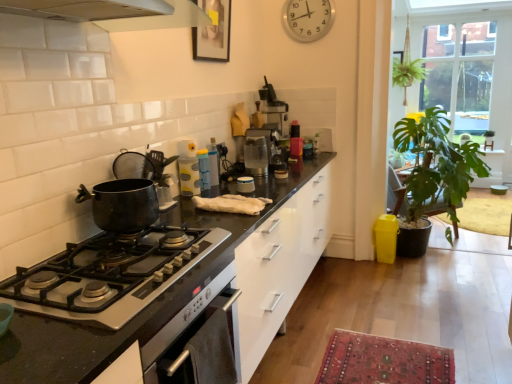
Find the location of a particular element. The width and height of the screenshot is (512, 384). translucent plastic container at center, the 2th appliance when ordered from back to front is located at coordinates (204, 171).

Describe the element at coordinates (110, 275) in the screenshot. The height and width of the screenshot is (384, 512). I see `black matte gas stove at lower left` at that location.

Where is `translucent plastic spray bottle at center, arranged as the 3th appliance when viewed from the top`? translucent plastic spray bottle at center, arranged as the 3th appliance when viewed from the top is located at coordinates (188, 168).

The width and height of the screenshot is (512, 384). In order to click on clear glass window at upper right in this screenshot , I will do `click(459, 74)`.

In order to click on wooden picture frame at upper center in this screenshot , I will do `click(213, 32)`.

Is clear glass window at upper right wider or thinner than metallic coffee machine at upper center, the first appliance positioned from the back?

Clearly, clear glass window at upper right has more width compared to metallic coffee machine at upper center, the first appliance positioned from the back.

Does clear glass window at upper right appear on the left side of metallic coffee machine at upper center, placed as the 1th appliance when sorted from right to left?

No, clear glass window at upper right is not to the left of metallic coffee machine at upper center, placed as the 1th appliance when sorted from right to left.

From a real-world perspective, is clear glass window at upper right above or below metallic coffee machine at upper center, arranged as the 1th appliance when viewed from the top?

In terms of real-world spatial position, clear glass window at upper right is above metallic coffee machine at upper center, arranged as the 1th appliance when viewed from the top.

Is clear glass window at upper right surrounding metallic coffee machine at upper center, placed as the 4th appliance when sorted from left to right?

No.

From a real-world perspective, who is located higher, white plastic container at center, the second appliance when ordered from right to left, or metallic coffee machine at upper center, placed as the 4th appliance when sorted from left to right?

metallic coffee machine at upper center, placed as the 4th appliance when sorted from left to right, is physically above.

Between point (241, 177) and point (270, 102), which one is positioned behind?

Point (270, 102)

Is white plastic container at center, which ranks as the 1th appliance in bottom-to-top order, far away from metallic coffee machine at upper center, the first appliance positioned from the back?

Yes, white plastic container at center, which ranks as the 1th appliance in bottom-to-top order, and metallic coffee machine at upper center, the first appliance positioned from the back, are quite far apart.

Is white plastic container at center, marked as the fourth appliance in a top-to-bottom arrangement, positioned with its back to metallic coffee machine at upper center, placed as the 4th appliance when sorted from left to right?

No, white plastic container at center, marked as the fourth appliance in a top-to-bottom arrangement, is not facing the opposite direction of metallic coffee machine at upper center, placed as the 4th appliance when sorted from left to right.

From the image's perspective, relative to green leafy plant at right, is matte black pot at left above or below?

matte black pot at left is situated lower than green leafy plant at right in the image.

You are a GUI agent. You are given a task and a screenshot of the screen. Output one action in this format:
    pyautogui.click(x=<x>, y=<y>)
    Task: Click on the kitchen appliance on the left of green leafy plant at right
    
    Given the screenshot: What is the action you would take?
    pyautogui.click(x=122, y=205)

Is matte black pot at left facing away from green leafy plant at right?

No, green leafy plant at right is not at the back of matte black pot at left.

Measure the distance from matte black pot at left to green leafy plant at right.

matte black pot at left is 8.60 feet from green leafy plant at right.

In the scene shown: Considering the sizes of clear glass coffee machine at center and black matte gas stove at lower left in the image, is clear glass coffee machine at center wider or thinner than black matte gas stove at lower left?

In the image, clear glass coffee machine at center appears to be more narrow than black matte gas stove at lower left.

Considering the positions of objects clear glass coffee machine at center and black matte gas stove at lower left in the image provided, who is more to the left, clear glass coffee machine at center or black matte gas stove at lower left?

black matte gas stove at lower left.

What are the coordinates of `coffee machine above the black matte gas stove at lower left (from the image's perspective)` in the screenshot? It's located at (257, 151).

Between point (128, 214) and point (205, 4), which one is positioned in front?

The point (128, 214) is more forward.

From the image's perspective, which is above, matte black pot at left or wooden picture frame at upper center?

wooden picture frame at upper center appears higher in the image.

What are the coordinates of `kitchen appliance on the left side of wooden picture frame at upper center` in the screenshot? It's located at (122, 205).

Choose the correct answer: Is wooden picture frame at upper center inside translucent plastic container at center, placed as the 2th appliance when sorted from top to bottom, or outside it?

wooden picture frame at upper center exists outside the volume of translucent plastic container at center, placed as the 2th appliance when sorted from top to bottom.

Considering the relative positions of wooden picture frame at upper center and translucent plastic container at center, marked as the third appliance in a right-to-left arrangement, in the image provided, is wooden picture frame at upper center to the left of translucent plastic container at center, marked as the third appliance in a right-to-left arrangement, from the viewer's perspective?

No, wooden picture frame at upper center is not to the left of translucent plastic container at center, marked as the third appliance in a right-to-left arrangement.

Are wooden picture frame at upper center and translucent plastic container at center, the 2th appliance when ordered from back to front, located far from each other?

No, wooden picture frame at upper center is not far away from translucent plastic container at center, the 2th appliance when ordered from back to front.

Considering the sizes of objects silver metallic clock at upper center and clear glass window at upper right in the image provided, who is smaller, silver metallic clock at upper center or clear glass window at upper right?

Smaller between the two is silver metallic clock at upper center.

From the image's perspective, is silver metallic clock at upper center located beneath clear glass window at upper right?

Yes, from the image's perspective, silver metallic clock at upper center is beneath clear glass window at upper right.

In the image, is silver metallic clock at upper center positioned in front of or behind clear glass window at upper right?

silver metallic clock at upper center is in front of clear glass window at upper right.

Is silver metallic clock at upper center looking in the opposite direction of clear glass window at upper right?

Correct, silver metallic clock at upper center is looking away from clear glass window at upper right.

Locate an element on the screen. window above the metallic coffee machine at upper center, arranged as the 1th appliance when viewed from the top (from the image's perspective) is located at coordinates (459, 74).

This screenshot has width=512, height=384. Identify the location of the 3rd appliance positioned below the metallic coffee machine at upper center, marked as the fourth appliance in a bottom-to-top arrangement (from a real-world perspective). tap(245, 185).

Which object lies nearer to the anchor point green leafy plant at right, translucent plastic spray bottle at center, which appears as the first appliance when viewed from the front, or metallic coffee machine at upper center, placed as the 4th appliance when sorted from left to right?

metallic coffee machine at upper center, placed as the 4th appliance when sorted from left to right.

Looking at the image, which one is located further to black matte gas stove at lower left, matte black pot at left or translucent plastic container at center, placed as the 2th appliance when sorted from top to bottom?

translucent plastic container at center, placed as the 2th appliance when sorted from top to bottom, is positioned further to the anchor black matte gas stove at lower left.

From the image, which object appears to be farther from green leafy plant at right, translucent plastic spray bottle at center, positioned as the fourth appliance in back-to-front order, or silver metallic clock at upper center?

Based on the image, translucent plastic spray bottle at center, positioned as the fourth appliance in back-to-front order, appears to be further to green leafy plant at right.

Estimate the real-world distances between objects in this image. Which object is further from clear glass window at upper right, metallic coffee machine at upper center, the 4th appliance when ordered from front to back, or translucent plastic container at center, which is the third appliance in front-to-back order?

translucent plastic container at center, which is the third appliance in front-to-back order, is positioned further to the anchor clear glass window at upper right.

Considering their positions, is white plastic container at center, which ranks as the 1th appliance in bottom-to-top order, positioned further to black matte gas stove at lower left than matte black pot at left?

white plastic container at center, which ranks as the 1th appliance in bottom-to-top order.

Based on their spatial positions, is wooden picture frame at upper center or white plastic container at center, which ranks as the 3th appliance in back-to-front order, further from silver metallic clock at upper center?

Based on the image, white plastic container at center, which ranks as the 3th appliance in back-to-front order, appears to be further to silver metallic clock at upper center.

Estimate the real-world distances between objects in this image. Which object is closer to white plastic container at center, the second appliance viewed from the front, translucent plastic spray bottle at center, positioned as the fourth appliance in back-to-front order, or clear glass window at upper right?

translucent plastic spray bottle at center, positioned as the fourth appliance in back-to-front order.

From the image, which object appears to be farther from wooden picture frame at upper center, silver metallic clock at upper center or translucent plastic container at center, placed as the 2th appliance when sorted from top to bottom?

silver metallic clock at upper center is positioned further to the anchor wooden picture frame at upper center.

This screenshot has width=512, height=384. I want to click on clock situated between white plastic container at center, which ranks as the 1th appliance in bottom-to-top order, and green leafy plant at right from left to right, so click(308, 19).

Locate an element on the screen. This screenshot has height=384, width=512. houseplant between wooden picture frame at upper center and clear glass window at upper right in the front-back direction is located at coordinates (436, 165).

Where is `coffee machine located between translucent plastic container at center, marked as the third appliance in a right-to-left arrangement, and metallic coffee machine at upper center, marked as the fourth appliance in a bottom-to-top arrangement, in the depth direction`? coffee machine located between translucent plastic container at center, marked as the third appliance in a right-to-left arrangement, and metallic coffee machine at upper center, marked as the fourth appliance in a bottom-to-top arrangement, in the depth direction is located at coordinates (257, 151).

At what (x,y) coordinates should I click in order to perform the action: click on houseplant located between translucent plastic container at center, which is the 3th appliance in bottom-to-top order, and clear glass window at upper right in the left-right direction. Please return your answer as a coordinate pair (x, y). This screenshot has width=512, height=384. Looking at the image, I should click on (436, 165).